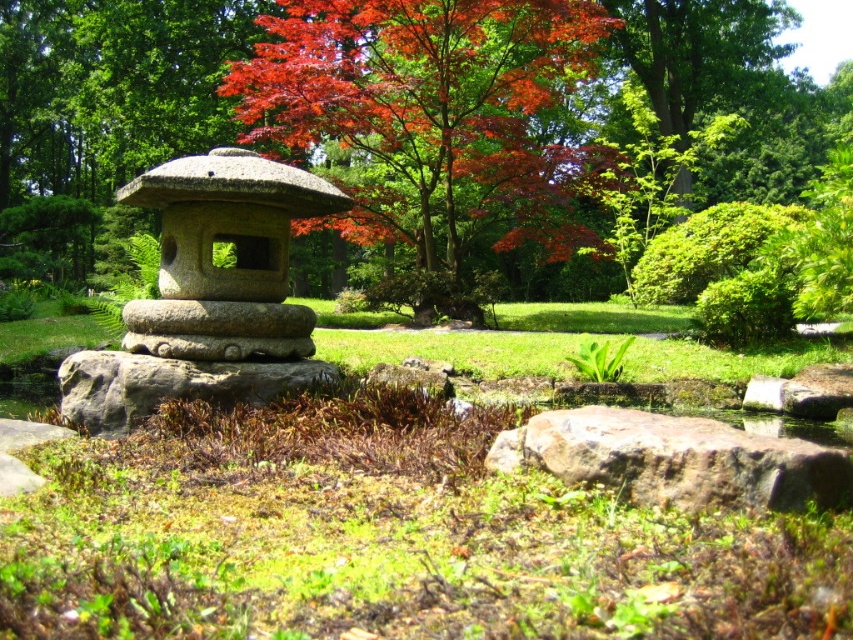
Question: Can you confirm if red leafy tree at center is wider than red leafy maple at center?

Choices:
 (A) yes
 (B) no

Answer: (A)

Question: Does red leafy maple at center appear under gray stone lantern at center?

Choices:
 (A) no
 (B) yes

Answer: (A)

Question: Which object is the closest to the gray stone lantern at center?

Choices:
 (A) red leafy tree at center
 (B) brown rough rock at center

Answer: (B)

Question: Is red leafy maple at center bigger than gray rough stone at center?

Choices:
 (A) no
 (B) yes

Answer: (B)

Question: Considering the real-world distances, which object is farthest from the brown rough rock at center?

Choices:
 (A) red leafy tree at center
 (B) gray rough stone at center
 (C) gray stone lantern at center

Answer: (A)

Question: Which point appears farthest from the camera in this image?

Choices:
 (A) click(219, 236)
 (B) click(751, 497)

Answer: (A)